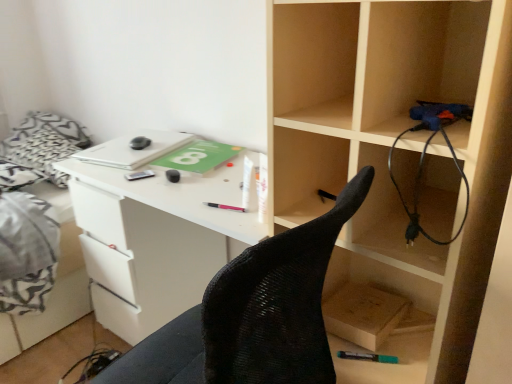
Locate an element on the screen. The width and height of the screenshot is (512, 384). vacant area to the left of metallic silver pen at center, the fourth stationery when ordered from right to left is located at coordinates (105, 171).